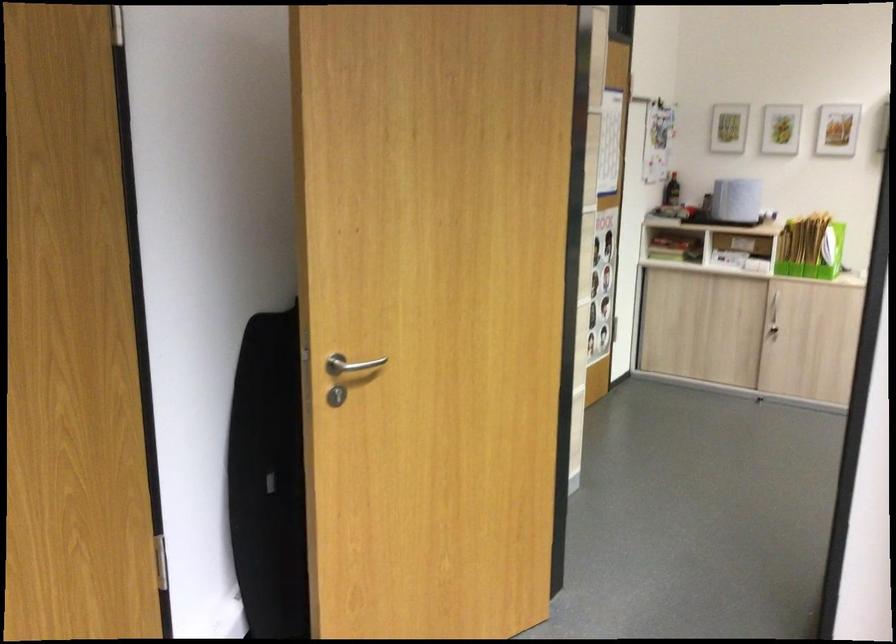
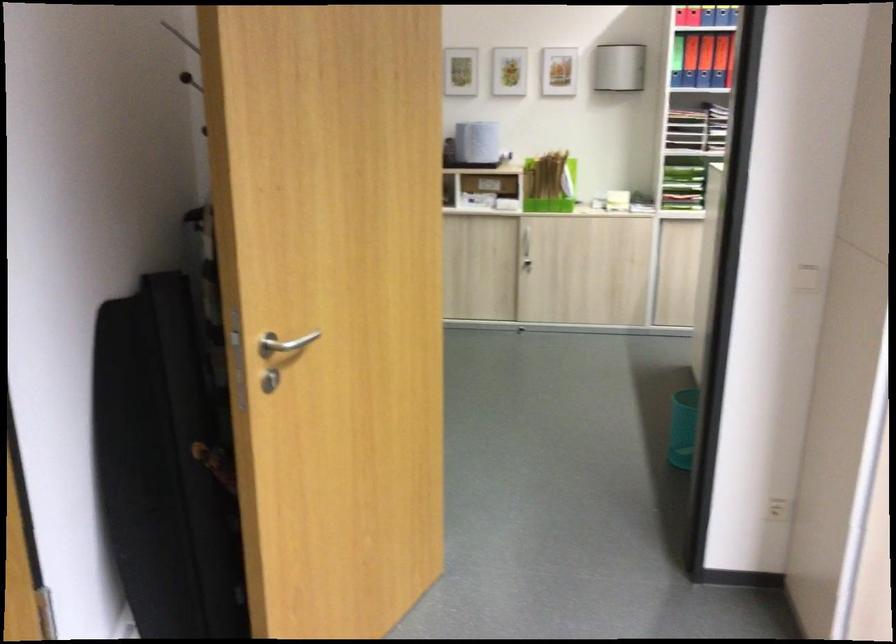
Question: The images are taken continuously from a first-person perspective. In which direction is your viewpoint rotating?

Choices:
 (A) Left
 (B) Right
 (C) Up
 (D) Down

Answer: (B)